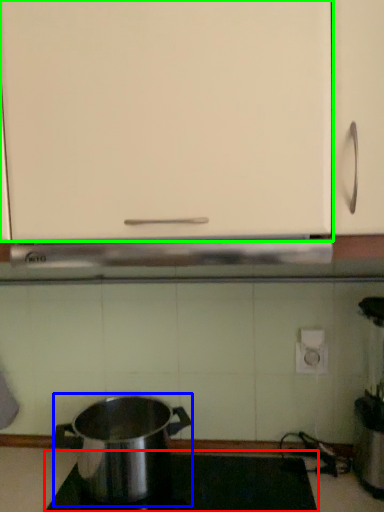
Question: Which object is positioned closest to gas stove (highlighted by a red box)? Select from kitchen appliance (highlighted by a blue box) and cabinetry (highlighted by a green box).

Choices:
 (A) kitchen appliance
 (B) cabinetry

Answer: (A)